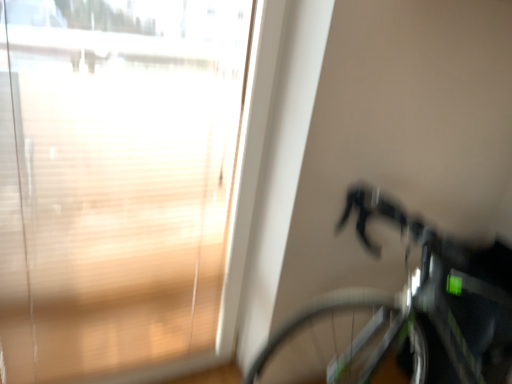
Question: Should I look upward or downward to see transparent glass window at upper left?

Choices:
 (A) up
 (B) down

Answer: (B)

Question: Does transparent glass window at upper left appear on the right side of shiny black bicycle at right?

Choices:
 (A) yes
 (B) no

Answer: (B)

Question: From the image's perspective, is transparent glass window at upper left under shiny black bicycle at right?

Choices:
 (A) no
 (B) yes

Answer: (A)

Question: Is transparent glass window at upper left closer to camera compared to shiny black bicycle at right?

Choices:
 (A) no
 (B) yes

Answer: (A)

Question: Is transparent glass window at upper left facing towards shiny black bicycle at right?

Choices:
 (A) no
 (B) yes

Answer: (A)

Question: Is shiny black bicycle at right completely or partially inside transparent glass window at upper left?

Choices:
 (A) no
 (B) yes

Answer: (A)

Question: Is transparent glass window at upper left touching shiny black bicycle at right?

Choices:
 (A) no
 (B) yes

Answer: (A)

Question: Is shiny black bicycle at right looking in the opposite direction of transparent glass window at upper left?

Choices:
 (A) yes
 (B) no

Answer: (B)

Question: Is shiny black bicycle at right smaller than transparent glass window at upper left?

Choices:
 (A) yes
 (B) no

Answer: (B)

Question: Can you confirm if shiny black bicycle at right is bigger than transparent glass window at upper left?

Choices:
 (A) no
 (B) yes

Answer: (B)

Question: From the image's perspective, is shiny black bicycle at right below transparent glass window at upper left?

Choices:
 (A) no
 (B) yes

Answer: (B)

Question: Is shiny black bicycle at right thinner than transparent glass window at upper left?

Choices:
 (A) yes
 (B) no

Answer: (B)

Question: From a real-world perspective, is shiny black bicycle at right positioned under transparent glass window at upper left based on gravity?

Choices:
 (A) yes
 (B) no

Answer: (A)

Question: Would you say shiny black bicycle at right is inside or outside transparent glass window at upper left?

Choices:
 (A) outside
 (B) inside

Answer: (A)